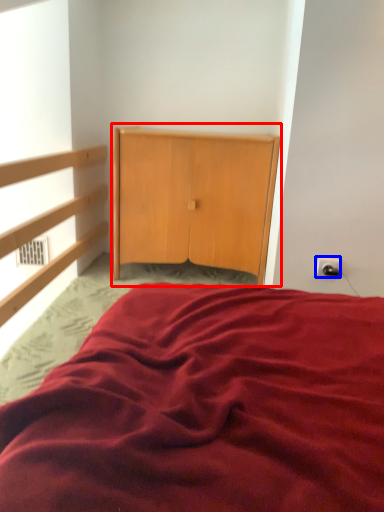
Question: Which object appears farthest to the camera in this image, dresser (highlighted by a red box) or electric outlet (highlighted by a blue box)?

Choices:
 (A) dresser
 (B) electric outlet

Answer: (A)